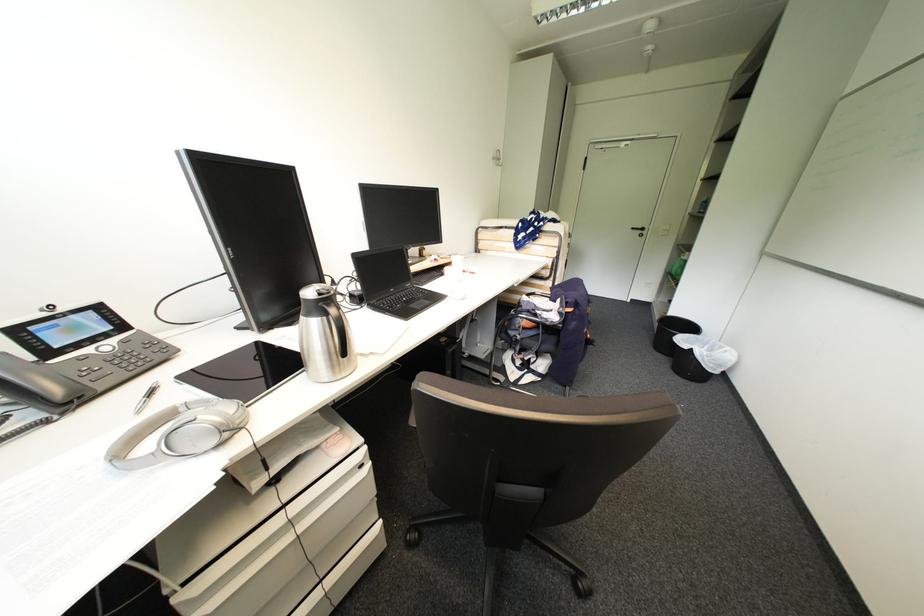
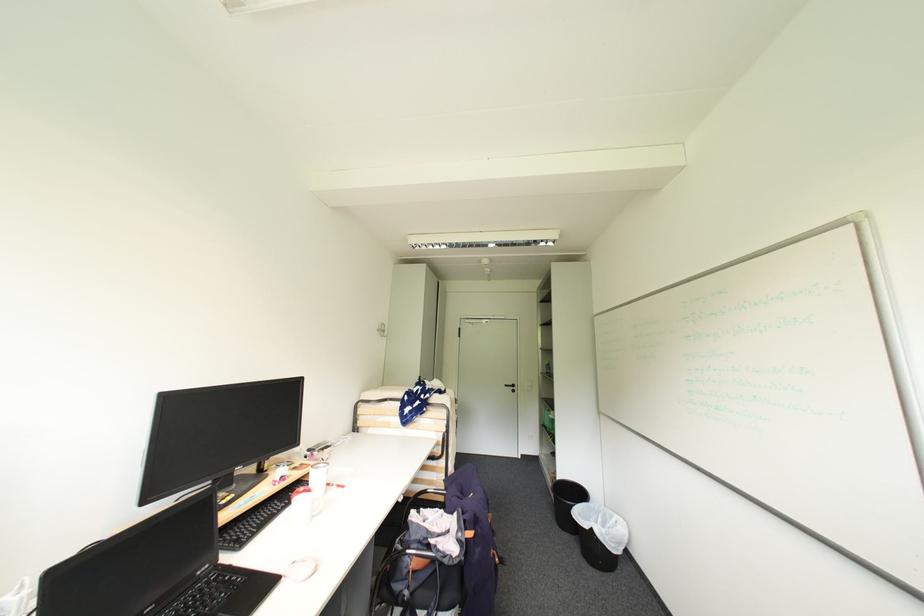
Find the pixel in the second image that matches pixel 542 315 in the first image.

(435, 548)